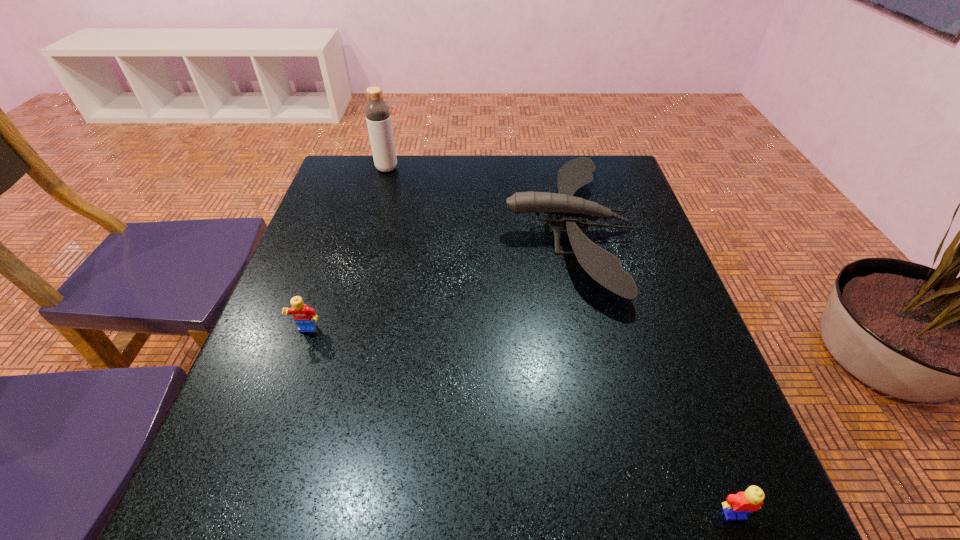
At what (x,y) coordinates should I click in order to perform the action: click on object that is at the far right corner. Please return your answer as a coordinate pair (x, y). The height and width of the screenshot is (540, 960). Looking at the image, I should click on (604, 267).

Locate an element on the screen. The width and height of the screenshot is (960, 540). object that is positioned at the near right corner is located at coordinates (751, 500).

This screenshot has height=540, width=960. In order to click on vacant space at the far edge of the desktop in this screenshot , I will do `click(506, 178)`.

This screenshot has width=960, height=540. I want to click on free region at the near edge, so click(350, 534).

Find the location of `vacant space at the left edge of the desktop`. vacant space at the left edge of the desktop is located at coordinates (321, 291).

Identify the location of free space at the right edge of the desktop. (628, 212).

This screenshot has height=540, width=960. Find the location of `free space at the far right corner`. free space at the far right corner is located at coordinates (622, 168).

This screenshot has width=960, height=540. Identify the location of free area in between the nearer Lego and the second object from left to right. (561, 341).

Find the location of `unoccupied position between the leftmost object and the drone`. unoccupied position between the leftmost object and the drone is located at coordinates (438, 280).

This screenshot has width=960, height=540. I want to click on empty space that is in between the bottle and the right Lego, so click(561, 341).